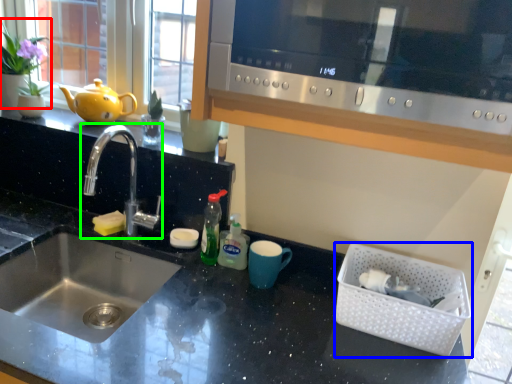
Question: Which object is the closest to the plant (highlighted by a red box)? Choose among these: basket (highlighted by a blue box) or tap (highlighted by a green box).

Choices:
 (A) basket
 (B) tap

Answer: (B)